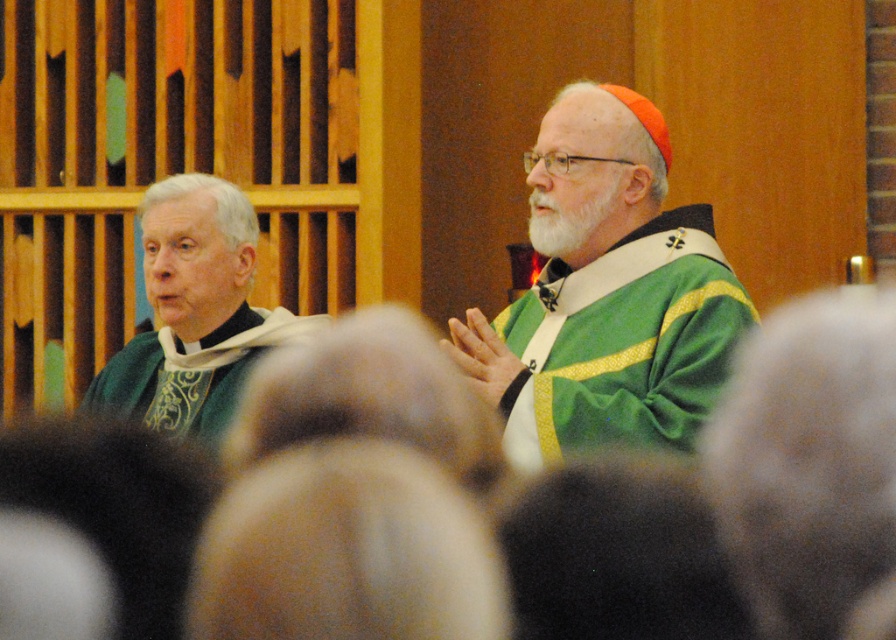
From the picture: Between green velvet robe at center and green velvet vestment at left, which one appears on the right side from the viewer's perspective?

green velvet robe at center

Does green velvet robe at center come in front of green velvet vestment at left?

Yes, it is.

Measure the distance between green velvet robe at center and camera.

The distance of green velvet robe at center from camera is 3.25 meters.

I want to click on green velvet robe at center, so click(606, 292).